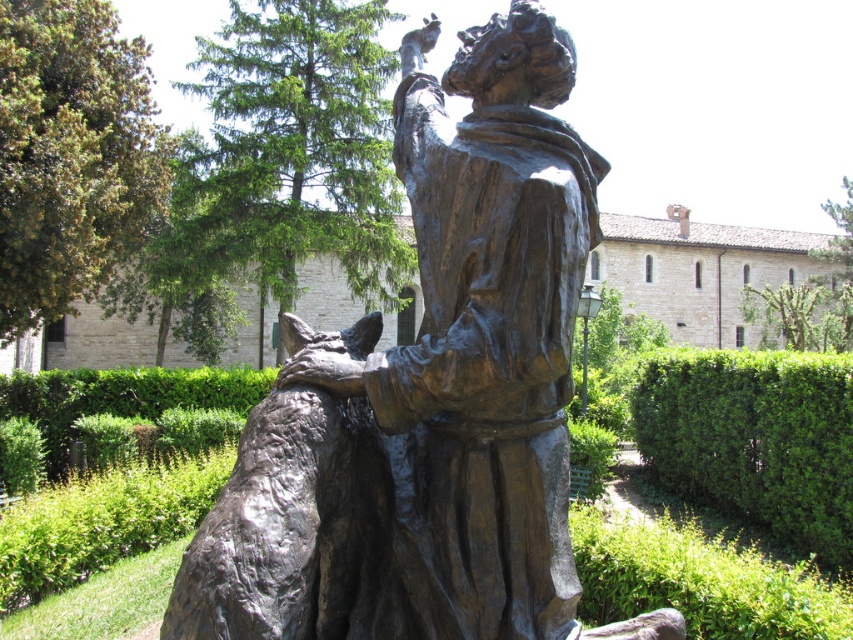
Which is below, bronze statue at center or green leafy hedge at right?

green leafy hedge at right

Between bronze statue at center and green leafy hedge at right, which one has less height?

With less height is green leafy hedge at right.

You are a GUI agent. You are given a task and a screenshot of the screen. Output one action in this format:
    pyautogui.click(x=<x>, y=<y>)
    Task: Click on the bronze statue at center
    The image size is (853, 640).
    Given the screenshot: What is the action you would take?
    pyautogui.click(x=483, y=336)

Find the location of a particular element. The width and height of the screenshot is (853, 640). bronze statue at center is located at coordinates (483, 336).